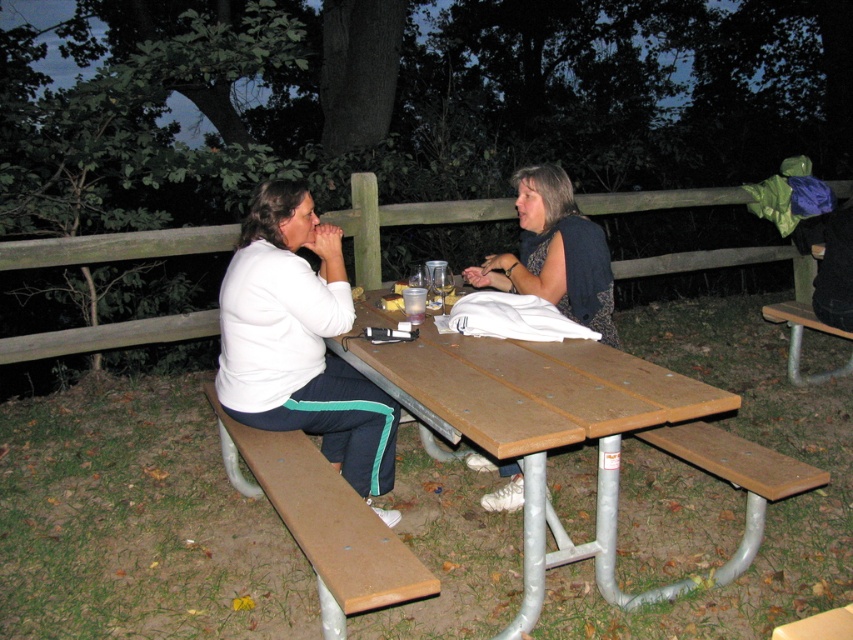
You are a photographer setting up a shot of the scene. You notice the matte black jacket at center and the brown wood bench at right. Which object is positioned higher in the image?

The matte black jacket at center is above the brown wood bench at right, so it is positioned higher in the image.

You are planning to place a large rectangular box on the brown wood picnic table at center. Considering the space occupied by the matte black jacket at center, can the box fit on the table without overlapping the jacket?

The brown wood picnic table at center is wider than the matte black jacket at center, so the box can fit on the table without overlapping the jacket as long as it is placed appropriately.

You are planning to place a rectangular box that is 1.2 meters wide on the picnic table. The matte black jacket at center and the brown wood bench at right are already on the table. Can the box fit on the table without overlapping either of these objects?

The matte black jacket at center is narrower than the brown wood bench at right. However, since the box is 1.2 meters wide and we don not have information about the total width of the table or the combined space taken by both objects, it is impossible to determine if the box will fit without overlapping them.